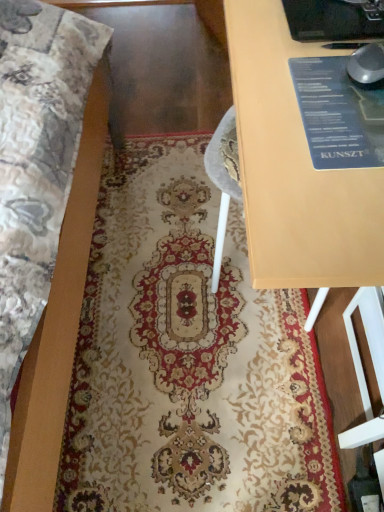
Question: Could you tell me if matte wood table at center is turned towards carpet with intricate patterns at center?

Choices:
 (A) yes
 (B) no

Answer: (B)

Question: Is matte wood table at center positioned beyond the bounds of carpet with intricate patterns at center?

Choices:
 (A) yes
 (B) no

Answer: (A)

Question: Is carpet with intricate patterns at center completely or partially inside matte wood table at center?

Choices:
 (A) yes
 (B) no

Answer: (B)

Question: From a real-world perspective, does matte wood table at center sit lower than carpet with intricate patterns at center?

Choices:
 (A) yes
 (B) no

Answer: (B)

Question: Considering the relative positions of matte wood table at center and carpet with intricate patterns at center in the image provided, is matte wood table at center to the left of carpet with intricate patterns at center from the viewer's perspective?

Choices:
 (A) yes
 (B) no

Answer: (B)

Question: Does matte wood table at center have a greater width compared to carpet with intricate patterns at center?

Choices:
 (A) yes
 (B) no

Answer: (B)

Question: Is carpet with intricate patterns at center looking in the opposite direction of matte wood table at center?

Choices:
 (A) yes
 (B) no

Answer: (B)

Question: Is carpet with intricate patterns at center wider than matte wood table at center?

Choices:
 (A) no
 (B) yes

Answer: (B)

Question: Can you confirm if carpet with intricate patterns at center is smaller than matte wood table at center?

Choices:
 (A) no
 (B) yes

Answer: (B)

Question: Is carpet with intricate patterns at center outside matte wood table at center?

Choices:
 (A) yes
 (B) no

Answer: (A)

Question: From a real-world perspective, is carpet with intricate patterns at center located beneath matte wood table at center?

Choices:
 (A) no
 (B) yes

Answer: (B)

Question: Does carpet with intricate patterns at center have a greater height compared to matte wood table at center?

Choices:
 (A) yes
 (B) no

Answer: (B)

Question: Is carpet with intricate patterns at center wider or thinner than matte wood table at center?

Choices:
 (A) thin
 (B) wide

Answer: (B)